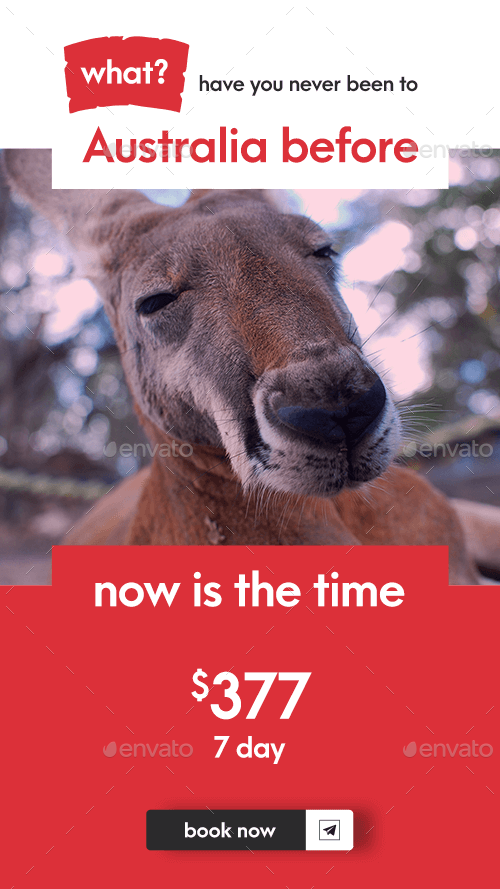
Image resolution: width=500 pixels, height=889 pixels. In order to click on book in this screenshot , I will do `click(207, 829)`.